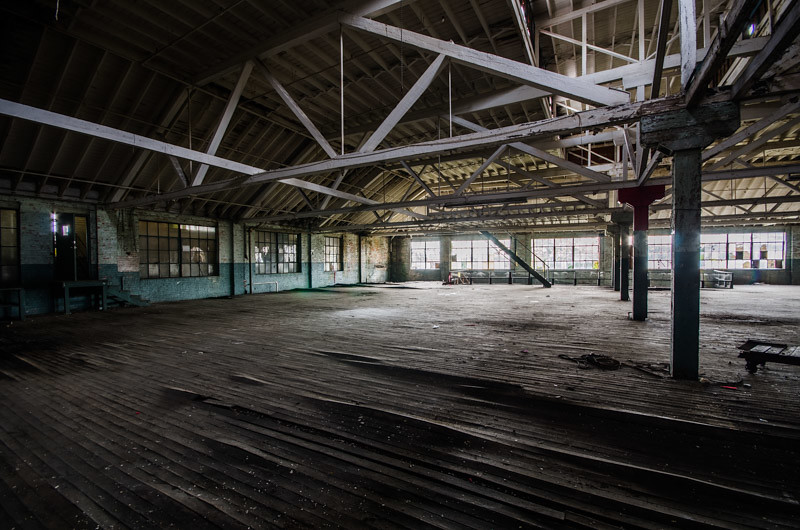
This screenshot has width=800, height=530. I want to click on door, so click(70, 254).